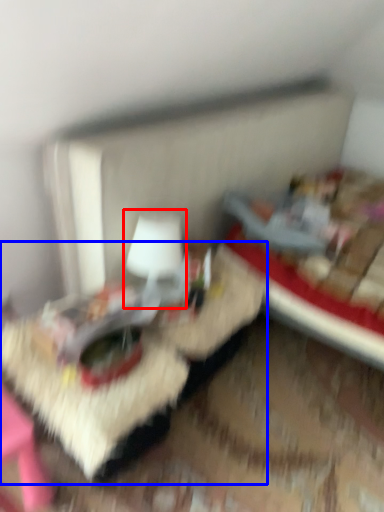
Question: Among these objects, which one is farthest to the camera, table lamp (highlighted by a red box) or table (highlighted by a blue box)?

Choices:
 (A) table lamp
 (B) table

Answer: (A)